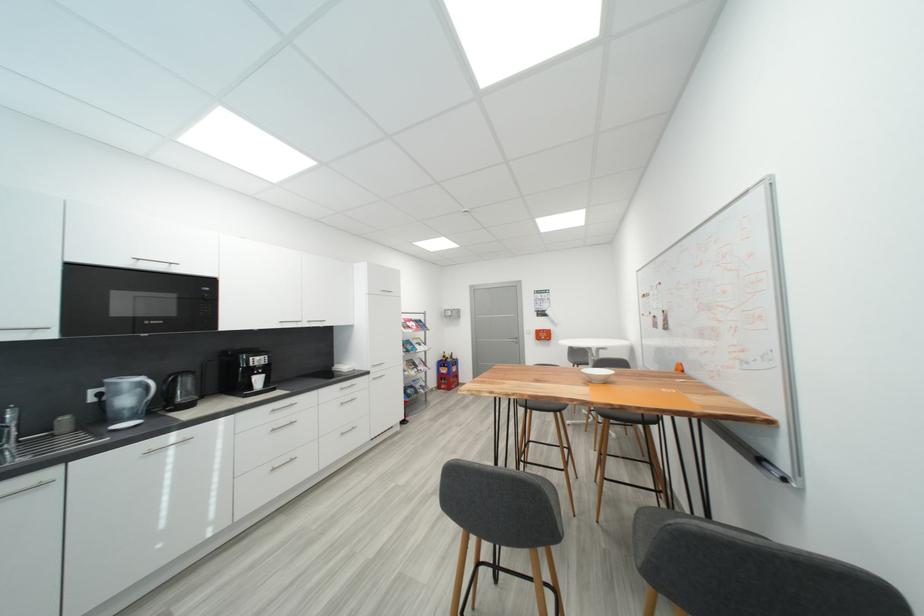
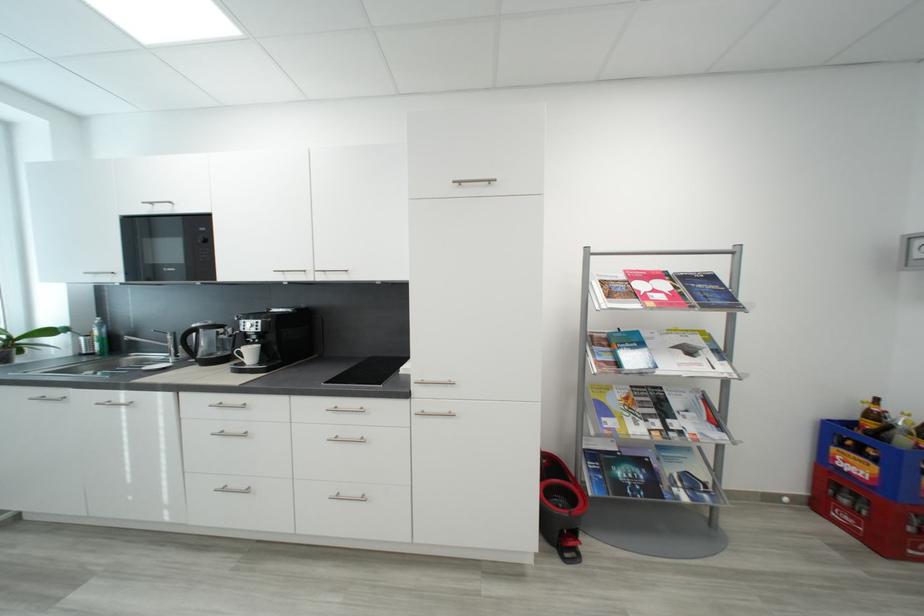
Where in the second image is the point corresponding to (x=265, y=382) from the first image?

(257, 354)